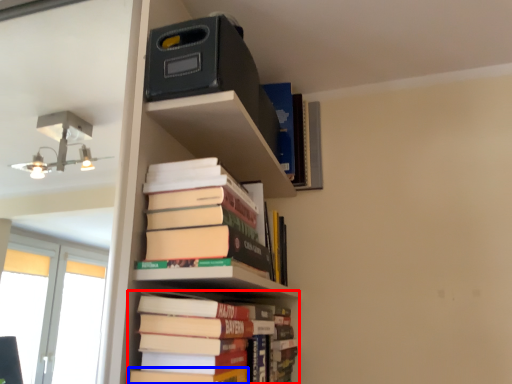
Question: Which object appears farthest to the camera in this image, book (highlighted by a red box) or paperback book (highlighted by a blue box)?

Choices:
 (A) book
 (B) paperback book

Answer: (A)